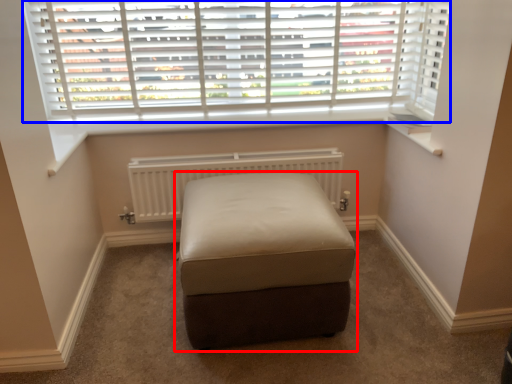
Question: Which of the following is the farthest to the observer, furniture (highlighted by a red box) or window (highlighted by a blue box)?

Choices:
 (A) furniture
 (B) window

Answer: (B)